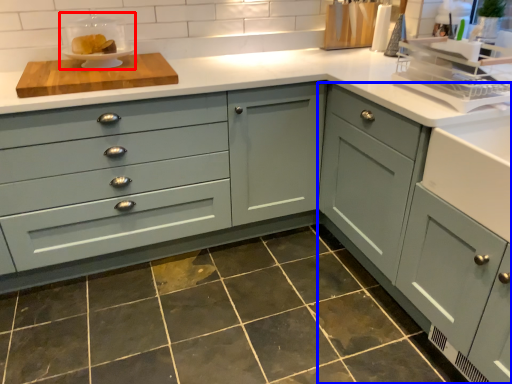
Question: Which object appears farthest to the camera in this image, appliance (highlighted by a red box) or cabinetry (highlighted by a blue box)?

Choices:
 (A) appliance
 (B) cabinetry

Answer: (A)